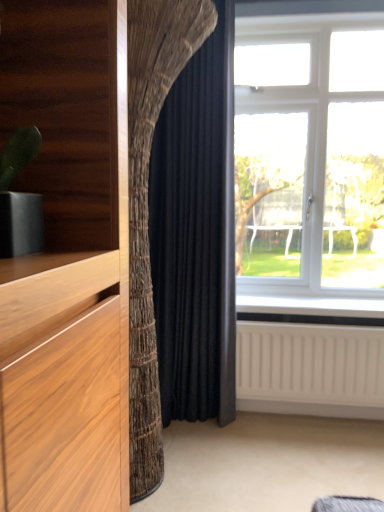
Where is `empty space that is ontop of white textured radiator at lower right (from a real-world perspective)`? Image resolution: width=384 pixels, height=512 pixels. empty space that is ontop of white textured radiator at lower right (from a real-world perspective) is located at coordinates (301, 323).